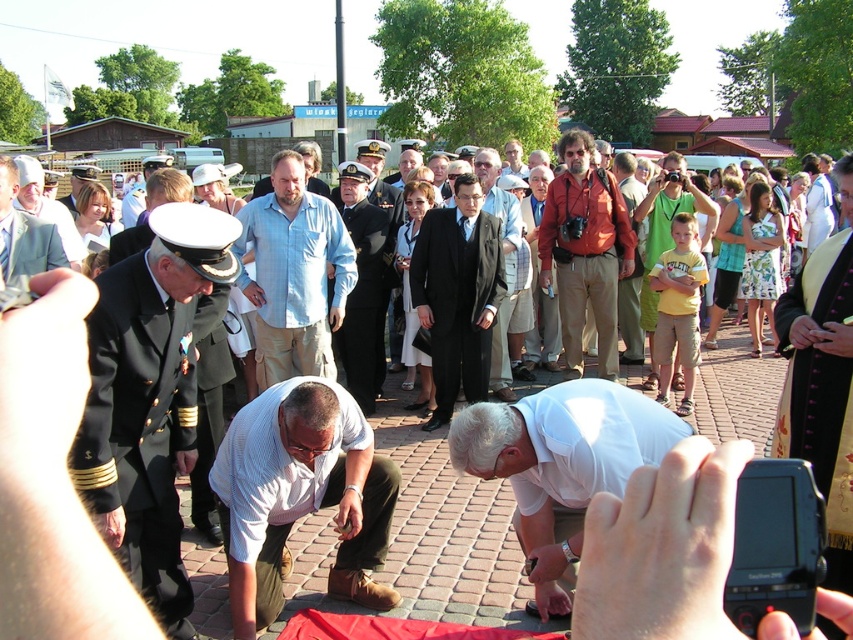
Question: Which point appears closest to the camera in this image?

Choices:
 (A) (25, 186)
 (B) (613, 305)

Answer: (A)

Question: Which of the following is the farthest from the observer?

Choices:
 (A) (292, 164)
 (B) (556, 145)

Answer: (B)

Question: Does white matte shirt at center appear under matte black suit at center?

Choices:
 (A) yes
 (B) no

Answer: (A)

Question: Can you confirm if dark blue uniform at center is smaller than matte orange jacket at center?

Choices:
 (A) no
 (B) yes

Answer: (B)

Question: Which of the following is the closest to the observer?

Choices:
 (A) (311, 465)
 (B) (607, 232)
 (C) (344, 179)
 (D) (158, 305)

Answer: (D)

Question: Does white striped shirt at center appear on the left side of light gray suit at center?

Choices:
 (A) yes
 (B) no

Answer: (B)